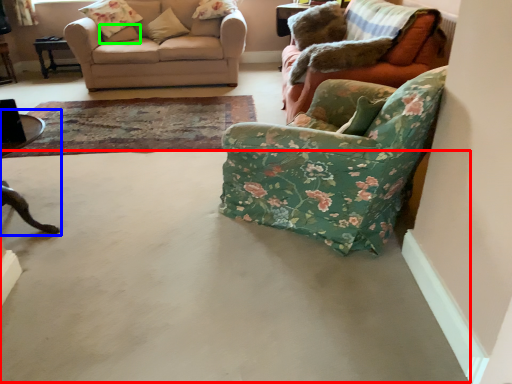
Question: Which object is positioned farthest from concrete (highlighted by a red box)? Select from table (highlighted by a blue box) and pillow (highlighted by a green box).

Choices:
 (A) table
 (B) pillow

Answer: (B)